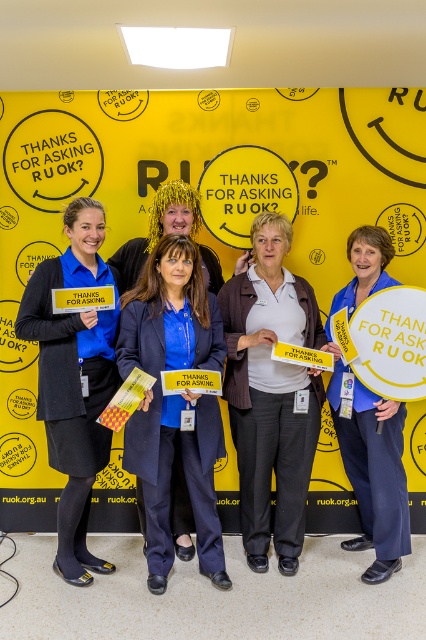
Question: Which is farther from the blue fabric sign at center?

Choices:
 (A) blue fabric coat at center
 (B) yellow paper sign at center
 (C) white cotton shirt at center
 (D) matte blue uniform at left

Answer: (D)

Question: Which is nearer to the yellow paper sign at center?

Choices:
 (A) matte blue uniform at left
 (B) white cotton shirt at center
 (C) blue fabric coat at center
 (D) blue fabric sign at center

Answer: (A)

Question: Which is nearer to the blue fabric coat at center?

Choices:
 (A) blue fabric sign at center
 (B) white cotton shirt at center

Answer: (B)

Question: Is matte blue uniform at left above blue fabric sign at center?

Choices:
 (A) yes
 (B) no

Answer: (A)

Question: Is matte blue uniform at left above blue fabric sign at center?

Choices:
 (A) yes
 (B) no

Answer: (A)

Question: Is yellow paper sign at center smaller than blue fabric coat at center?

Choices:
 (A) no
 (B) yes

Answer: (A)